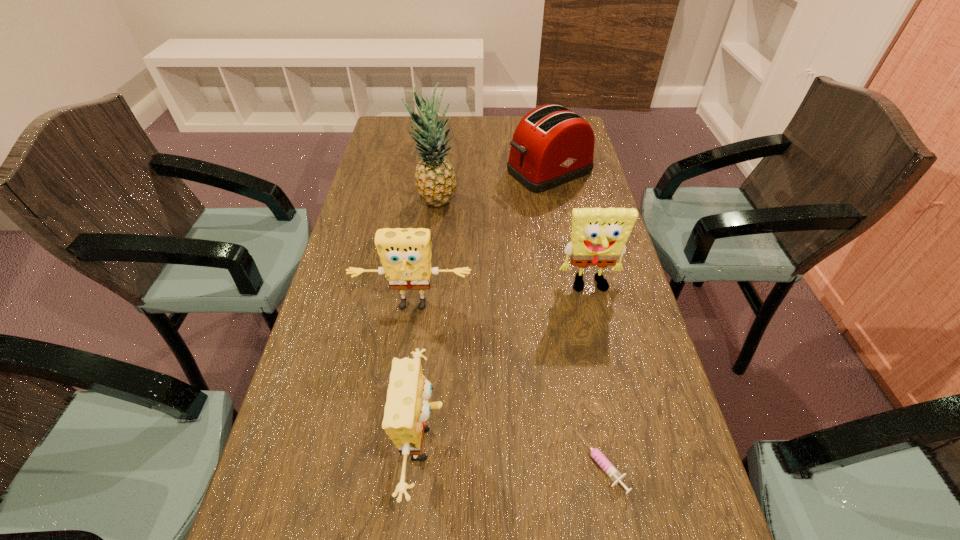
This screenshot has height=540, width=960. Identify the location of vacant space that satisfies the following two spatial constraints: 1. on the back side of the shortest object; 2. on the face of the nearest sponge. (597, 444).

Where is `free space that satisfies the following two spatial constraints: 1. on the face of the rightmost sponge; 2. on the face of the nearest sponge`? The height and width of the screenshot is (540, 960). free space that satisfies the following two spatial constraints: 1. on the face of the rightmost sponge; 2. on the face of the nearest sponge is located at coordinates (627, 444).